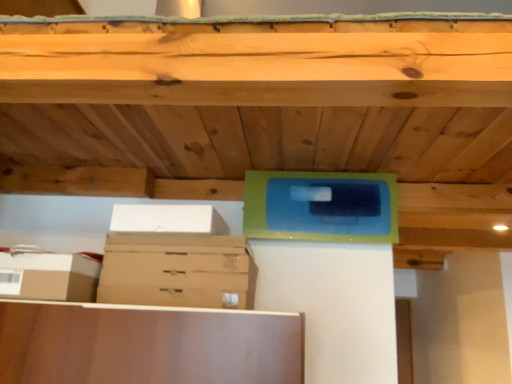
Question: Is brown cardboard drawer at center to the left or to the right of brown cardboard box at lower left, which appears as the second storage box when viewed from the right, in the image?

Choices:
 (A) right
 (B) left

Answer: (A)

Question: Looking at the image, does brown cardboard drawer at center seem bigger or smaller compared to brown cardboard box at lower left, which appears as the second storage box when viewed from the right?

Choices:
 (A) small
 (B) big

Answer: (B)

Question: Which object is positioned closest to the brown cardboard drawer at center?

Choices:
 (A) brown cardboard box at lower left, the first storage box viewed from the left
 (B) white cardboard box at upper left, the second storage box positioned from the bottom

Answer: (B)

Question: Which of these objects is positioned farthest from the brown cardboard drawer at center?

Choices:
 (A) white cardboard box at upper left, the 1th storage box in the right-to-left sequence
 (B) brown cardboard box at lower left, which appears as the 2th storage box when viewed from the top

Answer: (B)